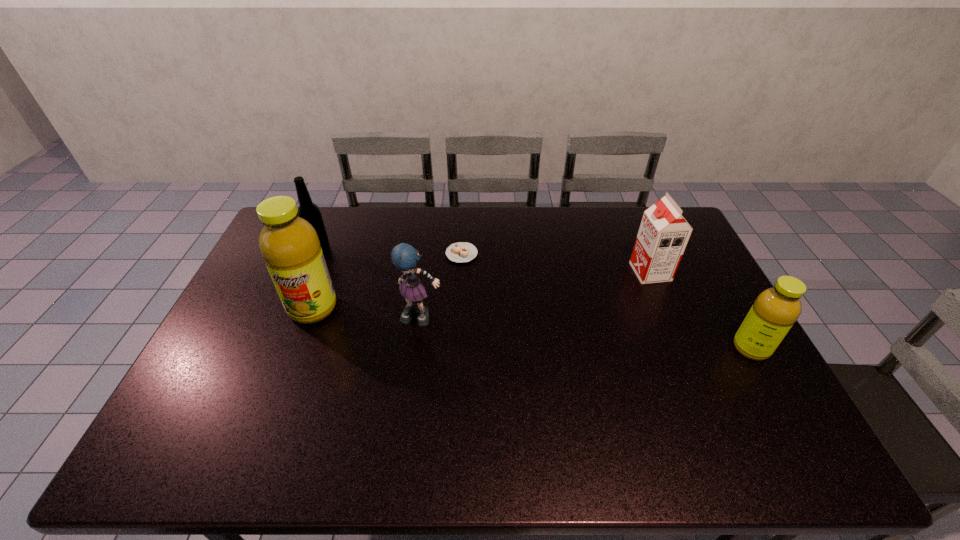
Identify the location of vacant space located 0.140m on the right of the beer bottle. (370, 248).

What are the coordinates of `free region located on the front-facing side of the rag doll` in the screenshot? It's located at (411, 401).

Locate an element on the screen. Image resolution: width=960 pixels, height=540 pixels. free space located 0.300m on the left of the cupcake is located at coordinates (360, 254).

Locate an element on the screen. This screenshot has width=960, height=540. beer bottle located in the far edge section of the desktop is located at coordinates (308, 210).

I want to click on cupcake present at the far edge, so click(459, 252).

Where is `object positioned at the left edge`? Image resolution: width=960 pixels, height=540 pixels. object positioned at the left edge is located at coordinates (308, 210).

You are a GUI agent. You are given a task and a screenshot of the screen. Output one action in this format:
    pyautogui.click(x=<x>, y=<y>)
    Task: Click on the fruit juice that is positioned at the right edge
    Image resolution: width=960 pixels, height=540 pixels.
    Given the screenshot: What is the action you would take?
    tap(775, 310)

You are a GUI agent. You are given a task and a screenshot of the screen. Output one action in this format:
    pyautogui.click(x=<x>, y=<y>)
    Task: Click on the soya milk that is at the right edge
    This screenshot has height=540, width=960.
    Given the screenshot: What is the action you would take?
    pyautogui.click(x=663, y=234)

You are a GUI agent. You are given a task and a screenshot of the screen. Output one action in this format:
    pyautogui.click(x=<x>, y=<y>)
    Task: Click on the object present at the far left corner
    Image resolution: width=960 pixels, height=540 pixels.
    Given the screenshot: What is the action you would take?
    pyautogui.click(x=308, y=210)

Image resolution: width=960 pixels, height=540 pixels. Identify the location of vacant space at the far edge of the desktop. (350, 242).